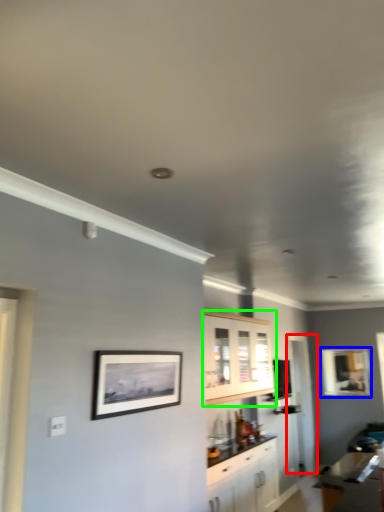
Question: Which object is positioned closest to glass door (highlighted by a red box)? Select from picture frame (highlighted by a blue box) and cabinetry (highlighted by a green box).

Choices:
 (A) picture frame
 (B) cabinetry

Answer: (A)